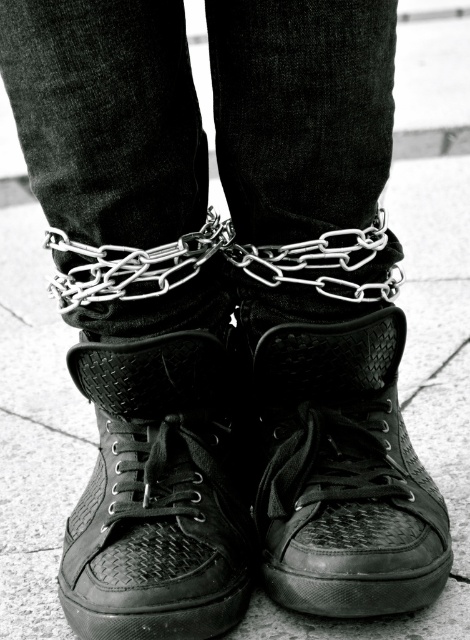
You are a fashion designer observing the image. You need to determine the placement of the matte black sneaker at center and metallic chain at center. Which object is positioned lower on the person?

The matte black sneaker at center is positioned lower than the metallic chain at center because the sneaker is below the chain.

You are a fashion designer analyzing the image. You need to decide which item is taller between the black woven fabric shoe at center and the metallic chain at center. Which one is taller?

The black woven fabric shoe at center is taller than the metallic chain at center.

You are a photographer standing in front of the black woven fabric shoe at center. You want to take a closeup shot of it. If your camera can focus on objects within 30 inches, will you need to move closer or farther away?

The black woven fabric shoe at center is 31.15 inches away from the viewer. Since your camera can focus within 30 inches, you need to move closer to get a clear closeup shot.